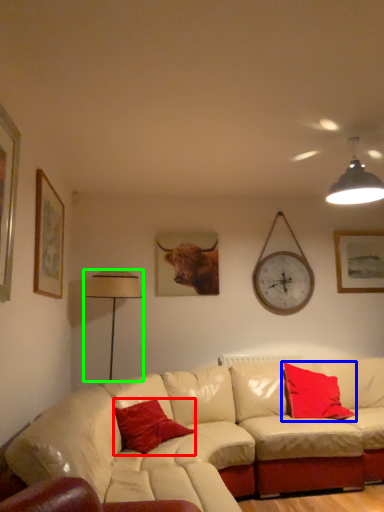
Question: Which object is positioned closest to pillow (highlighted by a red box)? Select from pillow (highlighted by a blue box) and table lamp (highlighted by a green box).

Choices:
 (A) pillow
 (B) table lamp

Answer: (B)